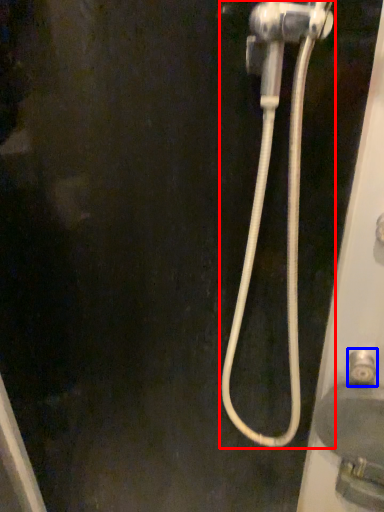
Question: Which object appears closest to the camera in this image, plumbing fixture (highlighted by a red box) or faucet (highlighted by a blue box)?

Choices:
 (A) plumbing fixture
 (B) faucet

Answer: (A)